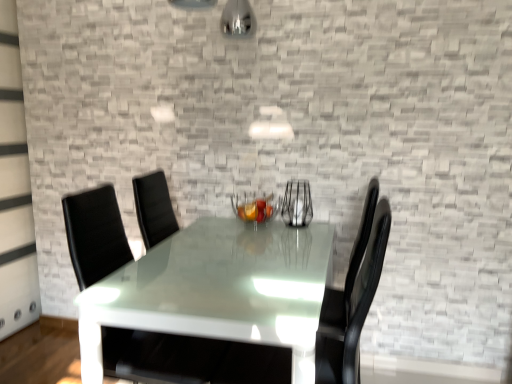
You are a GUI agent. You are given a task and a screenshot of the screen. Output one action in this format:
    pyautogui.click(x=<x>, y=<y>)
    Task: Click on the vacant space in front of clear glass vase at center
    
    Given the screenshot: What is the action you would take?
    click(x=294, y=235)